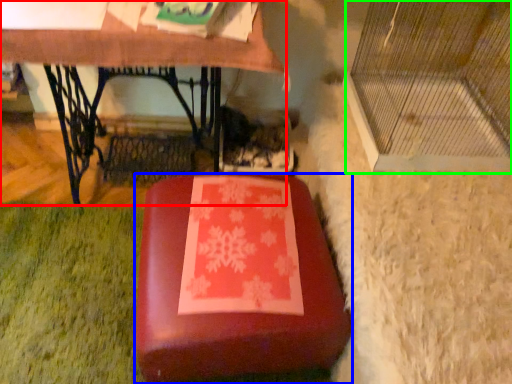
Question: Which object is the closest to the table (highlighted by a red box)? Choose among these: furniture (highlighted by a blue box) or glass door (highlighted by a green box).

Choices:
 (A) furniture
 (B) glass door

Answer: (B)